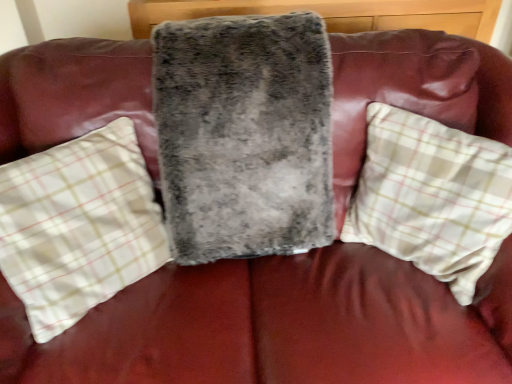
Image resolution: width=512 pixels, height=384 pixels. What do you see at coordinates (432, 197) in the screenshot?
I see `white plaid pillow at right, which is the 2th pillow in left-to-right order` at bounding box center [432, 197].

What do you see at coordinates (78, 226) in the screenshot? I see `fuzzy gray pillow at center, the 1th pillow from the left` at bounding box center [78, 226].

At what (x,y) coordinates should I click in order to perform the action: click on white plaid pillow at right, which is the 2th pillow in left-to-right order. Please return your answer as a coordinate pair (x, y). This screenshot has width=512, height=384. Looking at the image, I should click on (432, 197).

Would you say white plaid pillow at right, which is the 2th pillow in left-to-right order, is a long distance from fuzzy gray pillow at center, which ranks as the second pillow in right-to-left order?

No, there isn't a large distance between white plaid pillow at right, which is the 2th pillow in left-to-right order, and fuzzy gray pillow at center, which ranks as the second pillow in right-to-left order.

Does white plaid pillow at right, which ranks as the first pillow in right-to-left order, have a greater height compared to fuzzy gray pillow at center, the 1th pillow from the left?

No.

Considering the sizes of objects white plaid pillow at right, which ranks as the first pillow in right-to-left order, and fuzzy gray pillow at center, which ranks as the second pillow in right-to-left order, in the image provided, who is thinner, white plaid pillow at right, which ranks as the first pillow in right-to-left order, or fuzzy gray pillow at center, which ranks as the second pillow in right-to-left order,?

white plaid pillow at right, which ranks as the first pillow in right-to-left order.

Find the location of `pillow above the fuzzy gray pillow at center, the 1th pillow from the left (from the image's perspective)`. pillow above the fuzzy gray pillow at center, the 1th pillow from the left (from the image's perspective) is located at coordinates (432, 197).

Considering the relative sizes of fuzzy gray blanket at center and white plaid pillow at right, which ranks as the first pillow in right-to-left order, in the image provided, is fuzzy gray blanket at center wider than white plaid pillow at right, which ranks as the first pillow in right-to-left order,?

Correct, the width of fuzzy gray blanket at center exceeds that of white plaid pillow at right, which ranks as the first pillow in right-to-left order.

Is fuzzy gray blanket at center not near white plaid pillow at right, which is the 2th pillow in left-to-right order?

fuzzy gray blanket at center is actually quite close to white plaid pillow at right, which is the 2th pillow in left-to-right order.

This screenshot has width=512, height=384. What are the coordinates of `pillow that is the 1st one when counting forward from the fuzzy gray blanket at center` in the screenshot? It's located at (432, 197).

Who is smaller, fuzzy gray blanket at center or white plaid pillow at right, which ranks as the first pillow in right-to-left order?

With smaller size is white plaid pillow at right, which ranks as the first pillow in right-to-left order.

Is fuzzy gray pillow at center, which ranks as the second pillow in right-to-left order, outside of fuzzy gray blanket at center?

Absolutely, fuzzy gray pillow at center, which ranks as the second pillow in right-to-left order, is external to fuzzy gray blanket at center.

Locate an element on the screen. blanket behind the fuzzy gray pillow at center, which ranks as the second pillow in right-to-left order is located at coordinates (244, 135).

Is fuzzy gray pillow at center, the 1th pillow from the left, wider than fuzzy gray blanket at center?

No, fuzzy gray pillow at center, the 1th pillow from the left, is not wider than fuzzy gray blanket at center.

Could you tell me if fuzzy gray pillow at center, which ranks as the second pillow in right-to-left order, is turned towards fuzzy gray blanket at center?

No.

Is fuzzy gray pillow at center, the 1th pillow from the left, directly adjacent to white plaid pillow at right, which is the 2th pillow in left-to-right order?

They are not placed beside each other.

Is fuzzy gray pillow at center, which ranks as the second pillow in right-to-left order, spatially inside white plaid pillow at right, which ranks as the first pillow in right-to-left order, or outside of it?

fuzzy gray pillow at center, which ranks as the second pillow in right-to-left order, is not inside white plaid pillow at right, which ranks as the first pillow in right-to-left order, it's outside.

From the image's perspective, is fuzzy gray pillow at center, the 1th pillow from the left, over white plaid pillow at right, which is the 2th pillow in left-to-right order?

No, from the image's perspective, fuzzy gray pillow at center, the 1th pillow from the left, is not on top of white plaid pillow at right, which is the 2th pillow in left-to-right order.

Is fuzzy gray pillow at center, the 1th pillow from the left, bigger or smaller than white plaid pillow at right, which ranks as the first pillow in right-to-left order?

Clearly, fuzzy gray pillow at center, the 1th pillow from the left, is larger in size than white plaid pillow at right, which ranks as the first pillow in right-to-left order.

Are fuzzy gray blanket at center and fuzzy gray pillow at center, the 1th pillow from the left, located far from each other?

No.

From a real-world perspective, which object stands above the other?

fuzzy gray blanket at center, from a real-world perspective.

Can you confirm if fuzzy gray blanket at center is positioned to the left of fuzzy gray pillow at center, the 1th pillow from the left?

In fact, fuzzy gray blanket at center is to the right of fuzzy gray pillow at center, the 1th pillow from the left.

I want to click on pillow that is the 2nd object directly below the fuzzy gray blanket at center (from a real-world perspective), so click(78, 226).

Between point (465, 190) and point (257, 113), which one is positioned in front?

The point (465, 190) is more forward.

Can you see white plaid pillow at right, which ranks as the first pillow in right-to-left order, touching fuzzy gray blanket at center?

No, white plaid pillow at right, which ranks as the first pillow in right-to-left order, is not making contact with fuzzy gray blanket at center.

Considering the sizes of objects white plaid pillow at right, which is the 2th pillow in left-to-right order, and fuzzy gray blanket at center in the image provided, who is wider, white plaid pillow at right, which is the 2th pillow in left-to-right order, or fuzzy gray blanket at center?

fuzzy gray blanket at center.

The image size is (512, 384). In order to click on pillow that is behind the fuzzy gray pillow at center, the 1th pillow from the left in this screenshot , I will do coord(432,197).

You are a GUI agent. You are given a task and a screenshot of the screen. Output one action in this format:
    pyautogui.click(x=<x>, y=<y>)
    Task: Click on the blanket lying above the white plaid pillow at right, which ranks as the first pillow in right-to-left order (from the image's perspective)
    The height and width of the screenshot is (384, 512).
    Given the screenshot: What is the action you would take?
    pyautogui.click(x=244, y=135)

From the image, which object appears to be nearer to white plaid pillow at right, which is the 2th pillow in left-to-right order, fuzzy gray pillow at center, the 1th pillow from the left, or fuzzy gray blanket at center?

fuzzy gray blanket at center.

Looking at the image, which one is located further to fuzzy gray pillow at center, the 1th pillow from the left, fuzzy gray blanket at center or white plaid pillow at right, which ranks as the first pillow in right-to-left order?

Among the two, white plaid pillow at right, which ranks as the first pillow in right-to-left order, is located further to fuzzy gray pillow at center, the 1th pillow from the left.

Estimate the real-world distances between objects in this image. Which object is further from fuzzy gray pillow at center, the 1th pillow from the left, white plaid pillow at right, which is the 2th pillow in left-to-right order, or fuzzy gray blanket at center?

The object further to fuzzy gray pillow at center, the 1th pillow from the left, is white plaid pillow at right, which is the 2th pillow in left-to-right order.

When comparing their distances from fuzzy gray blanket at center, does white plaid pillow at right, which ranks as the first pillow in right-to-left order, or fuzzy gray pillow at center, which ranks as the second pillow in right-to-left order, seem further?

Among the two, white plaid pillow at right, which ranks as the first pillow in right-to-left order, is located further to fuzzy gray blanket at center.

Considering their positions, is fuzzy gray blanket at center positioned further to white plaid pillow at right, which is the 2th pillow in left-to-right order, than fuzzy gray pillow at center, which ranks as the second pillow in right-to-left order?

Among the two, fuzzy gray pillow at center, which ranks as the second pillow in right-to-left order, is located further to white plaid pillow at right, which is the 2th pillow in left-to-right order.

When comparing their distances from fuzzy gray blanket at center, does fuzzy gray pillow at center, which ranks as the second pillow in right-to-left order, or white plaid pillow at right, which is the 2th pillow in left-to-right order, seem closer?

fuzzy gray pillow at center, which ranks as the second pillow in right-to-left order, is positioned closer to the anchor fuzzy gray blanket at center.

Locate an element on the screen. The image size is (512, 384). blanket between fuzzy gray pillow at center, the 1th pillow from the left, and white plaid pillow at right, which ranks as the first pillow in right-to-left order, in the horizontal direction is located at coordinates (244, 135).